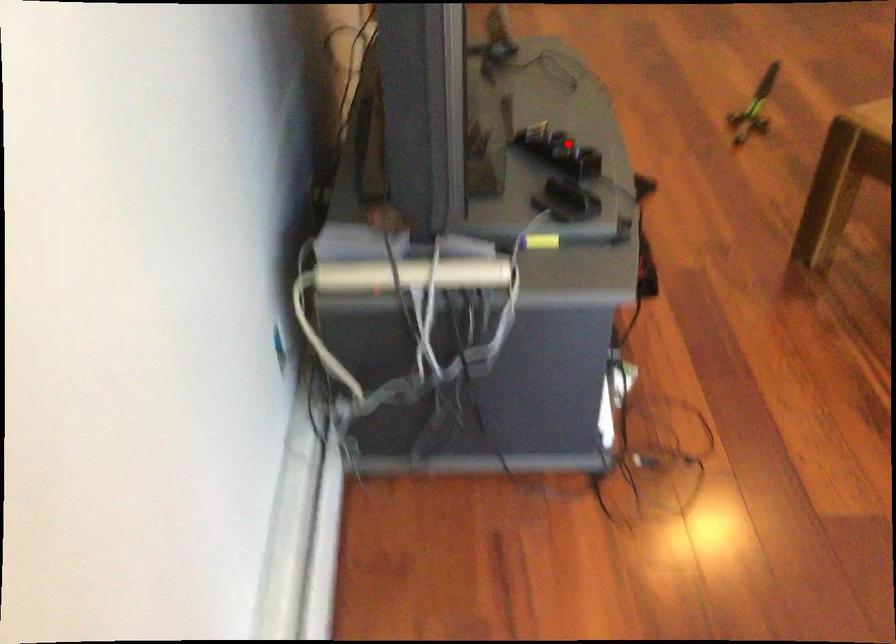
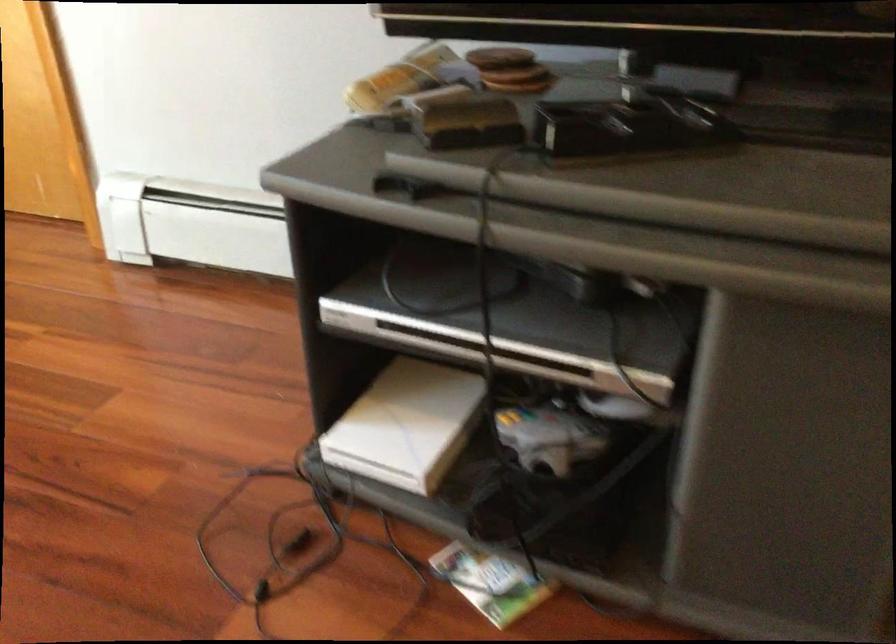
Question: A red point is marked in image1. In image2, is the corresponding 3D point closer to the camera or farther? Reply with the corresponding letter.

Choices:
 (A) The corresponding 3D point is closer.
 (B) The corresponding 3D point is farther.

Answer: (A)